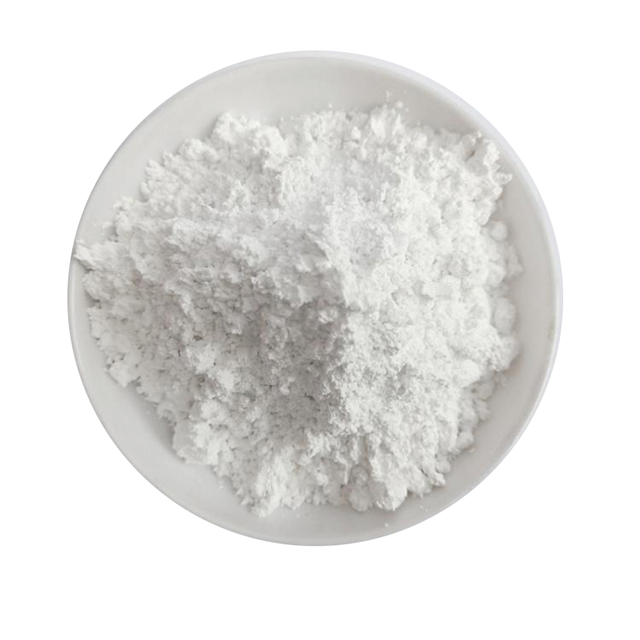
This screenshot has height=640, width=640. Find the location of `right side rim of bowl`. right side rim of bowl is located at coordinates (556, 323).